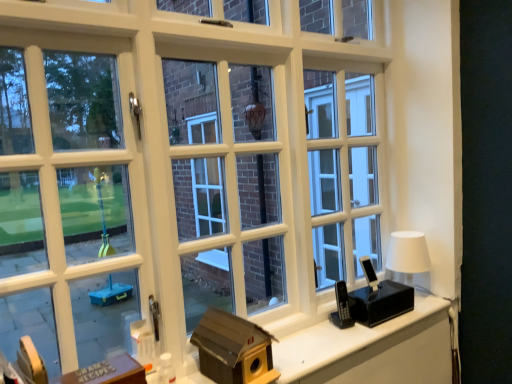
Question: From a real-world perspective, is wooden birdhouse at lower right physically located above or below white matte table lamp at right?

Choices:
 (A) above
 (B) below

Answer: (B)

Question: Considering the positions of wooden birdhouse at lower right and white matte table lamp at right in the image, is wooden birdhouse at lower right wider or thinner than white matte table lamp at right?

Choices:
 (A) wide
 (B) thin

Answer: (A)

Question: Which object is the closest to the white matte table lamp at right?

Choices:
 (A) metallic silver buttons at lower left
 (B) brown cardboard birdhouse at center
 (C) wooden birdhouse at lower right

Answer: (C)

Question: Estimate the real-world distances between objects in this image. Which object is farther from the metallic silver buttons at lower left?

Choices:
 (A) white matte table lamp at right
 (B) brown cardboard birdhouse at center
 (C) wooden birdhouse at lower right

Answer: (A)